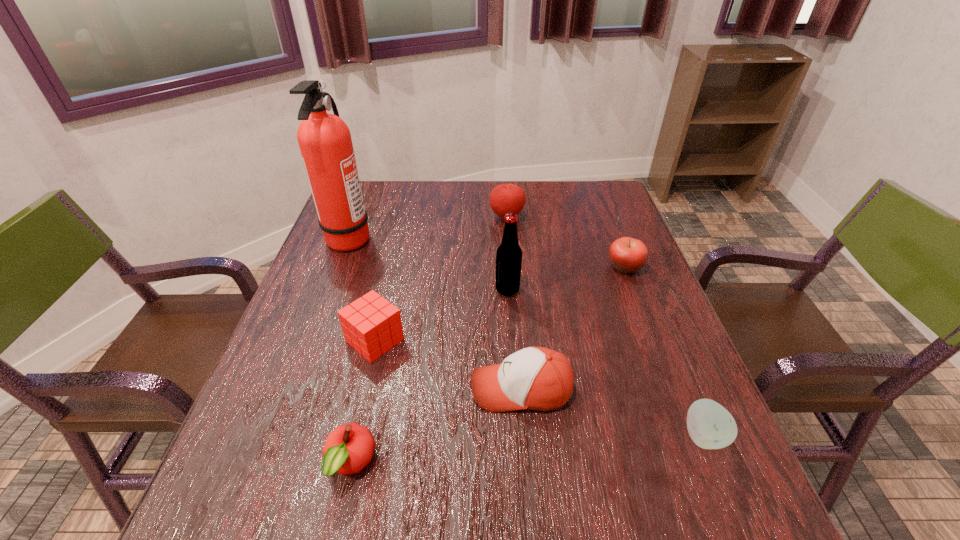
The image size is (960, 540). I want to click on vacant region located on the handle side of the leftmost object, so click(444, 238).

Locate an element on the screen. The height and width of the screenshot is (540, 960). vacant space situated 0.050m on the front of the fourth farthest object is located at coordinates (509, 313).

Find the location of a particular element. Image resolution: width=960 pixels, height=540 pixels. free space located 0.100m on the back of the third apple from right to left is located at coordinates (505, 192).

Locate an element on the screen. free space located on the front-facing side of the third nearest object is located at coordinates (357, 389).

The width and height of the screenshot is (960, 540). In order to click on free spot located 0.370m on the front-facing side of the third nearest object in this screenshot , I will do `click(288, 389)`.

The width and height of the screenshot is (960, 540). What are the coordinates of `vacant space located 0.340m on the front-facing side of the third nearest object` in the screenshot? It's located at (303, 389).

The image size is (960, 540). In order to click on free location located 0.070m on the right of the fourth nearest object in this screenshot , I will do `click(436, 340)`.

The height and width of the screenshot is (540, 960). What are the coordinates of `vacant space located 0.270m on the front of the second farthest apple` in the screenshot? It's located at (661, 362).

Where is `free region located 0.290m on the back of the leftmost apple`? This screenshot has width=960, height=540. free region located 0.290m on the back of the leftmost apple is located at coordinates (383, 319).

You are a GUI agent. You are given a task and a screenshot of the screen. Output one action in this format:
    pyautogui.click(x=<x>, y=<y>)
    Task: Click on the fire extinguisher that is positioned at the far edge
    The height and width of the screenshot is (540, 960).
    Given the screenshot: What is the action you would take?
    pyautogui.click(x=325, y=143)